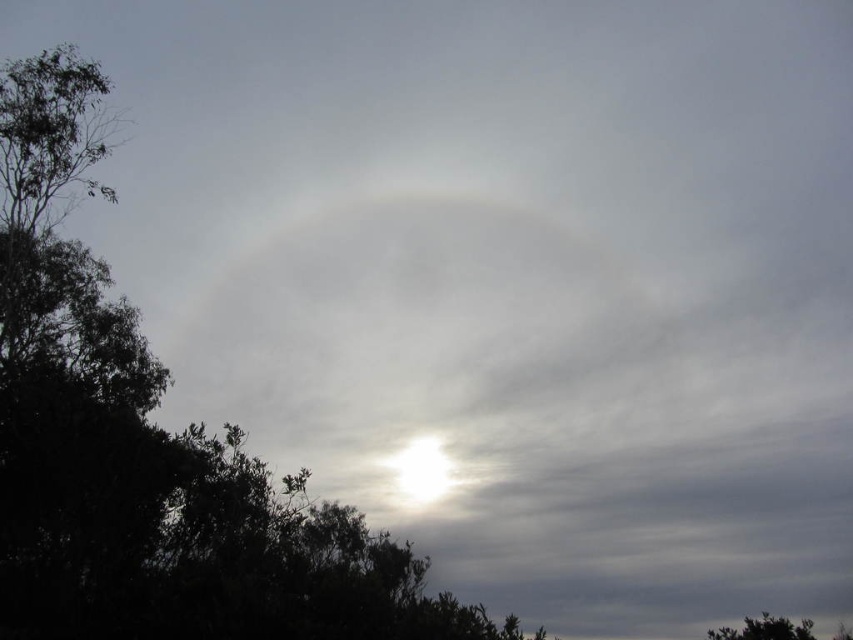
Question: Is green leafy tree at upper left to the left of green leafy tree at lower right from the viewer's perspective?

Choices:
 (A) yes
 (B) no

Answer: (A)

Question: Among these objects, which one is farthest from the camera?

Choices:
 (A) green leafy tree at upper left
 (B) green leafy tree at lower right

Answer: (B)

Question: Which of the following is the farthest from the observer?

Choices:
 (A) (119, 438)
 (B) (718, 632)

Answer: (B)

Question: Does green leafy tree at upper left appear under green leafy tree at lower right?

Choices:
 (A) no
 (B) yes

Answer: (A)

Question: Can you confirm if green leafy tree at upper left is positioned to the left of green leafy tree at lower right?

Choices:
 (A) no
 (B) yes

Answer: (B)